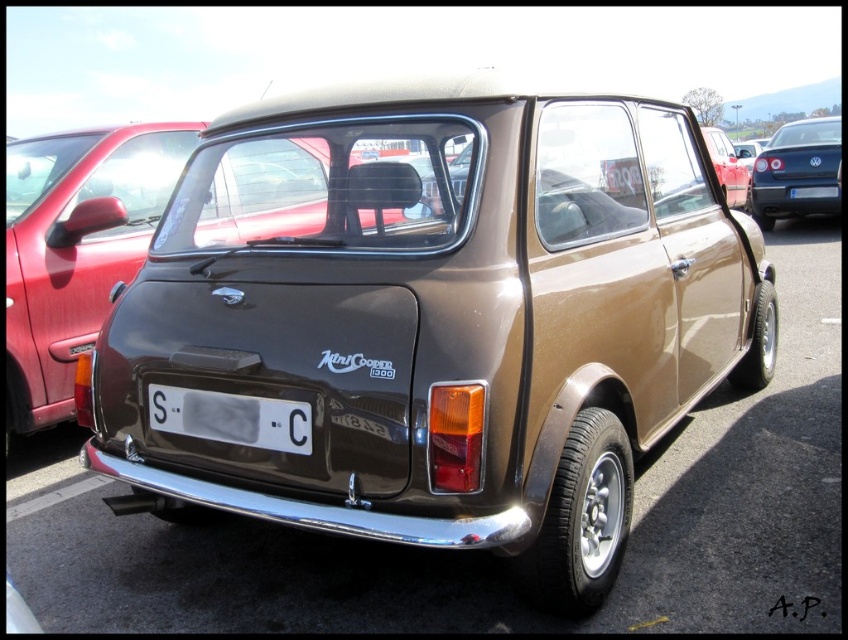
Question: Which point is farther from the camera taking this photo?

Choices:
 (A) (784, 195)
 (B) (182, 396)
 (C) (26, 362)

Answer: (A)

Question: Considering the relative positions of shiny blue sedan at upper right and white plastic license plate at center in the image provided, where is shiny blue sedan at upper right located with respect to white plastic license plate at center?

Choices:
 (A) right
 (B) left

Answer: (A)

Question: Which is farther from the shiny blue sedan at upper right?

Choices:
 (A) shiny brown car at center
 (B) white plastic license plate at center

Answer: (B)

Question: Observing the image, what is the correct spatial positioning of shiny brown car at center in reference to white plastic license plate at center?

Choices:
 (A) above
 (B) below

Answer: (A)

Question: Which point appears farthest from the camera in this image?

Choices:
 (A) (252, 428)
 (B) (68, 291)

Answer: (B)

Question: Is shiny blue sedan at upper right to the left of white plastic license plate at center from the viewer's perspective?

Choices:
 (A) no
 (B) yes

Answer: (A)